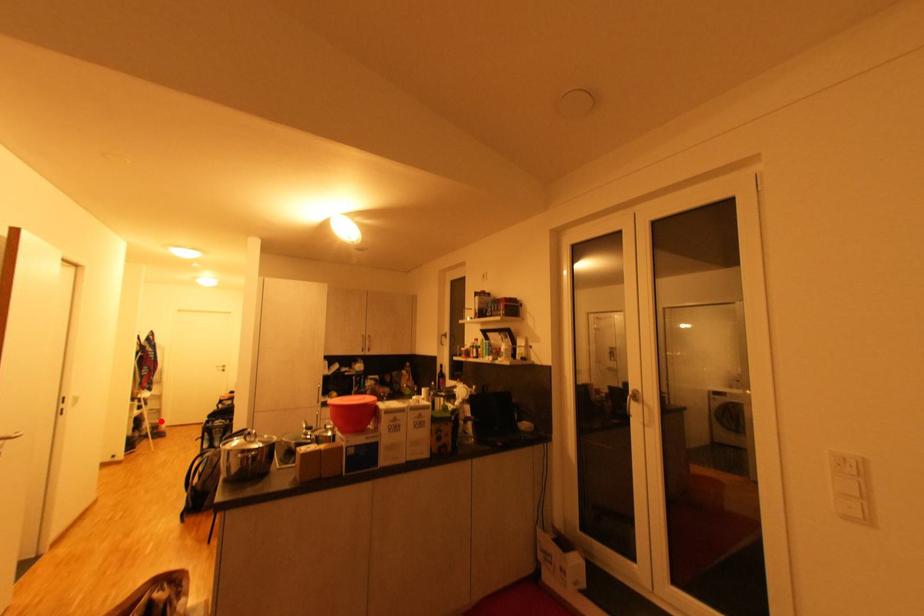
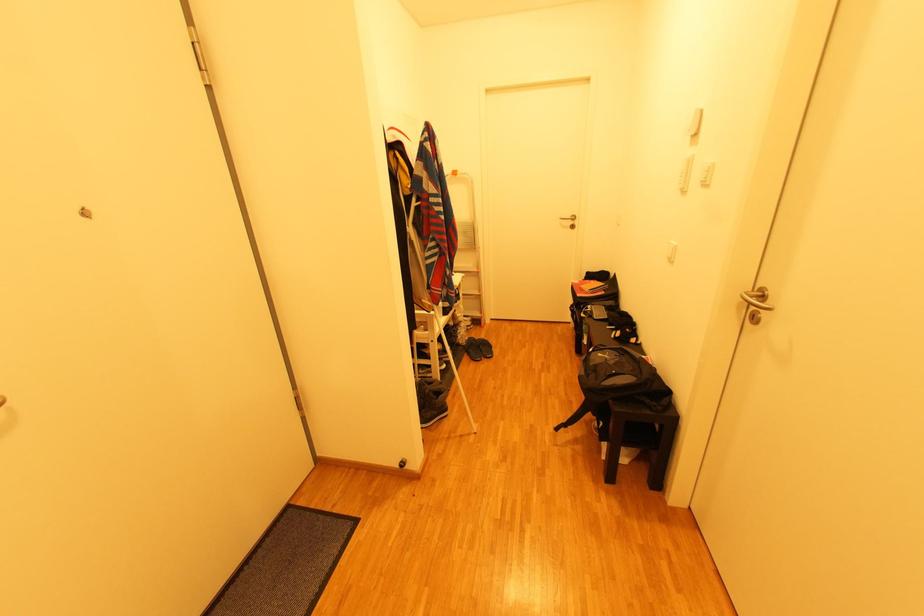
Question: I am providing you with two images of the same scene from different viewpoints. In image1, a red point is highlighted. Considering the same 3D point in image2, which of the following is correct?

Choices:
 (A) It is closer
 (B) It is farther

Answer: (B)